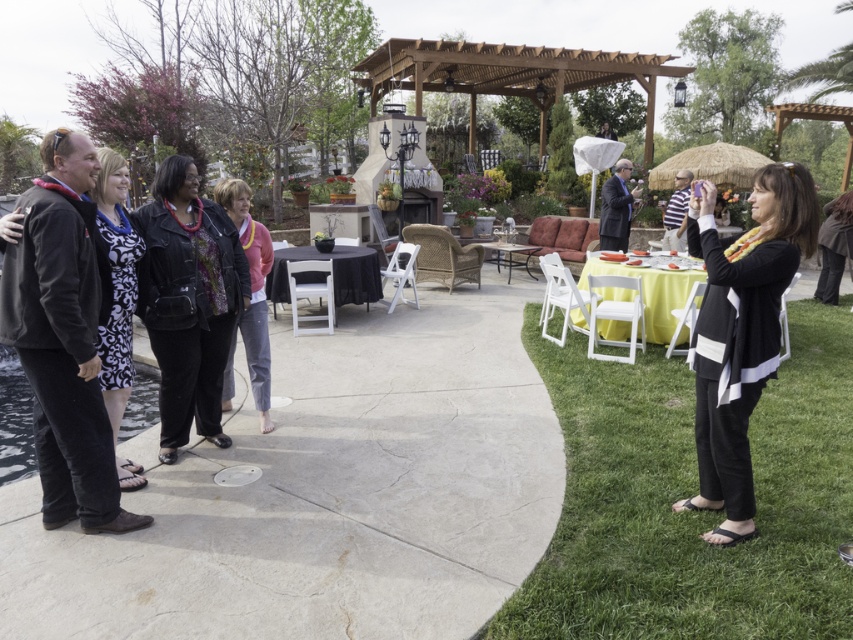
Question: Which of the following is the farthest from the observer?

Choices:
 (A) black matte jacket at right
 (B) black leather jacket at center
 (C) pink fabric jacket at center

Answer: (C)

Question: Is black matte jacket at right positioned in front of pink fabric jacket at center?

Choices:
 (A) no
 (B) yes

Answer: (B)

Question: Which object is farther from the camera taking this photo?

Choices:
 (A) pink fabric jacket at center
 (B) black leather jacket at center

Answer: (A)

Question: Does black matte jacket at right have a smaller size compared to black leather jacket at center?

Choices:
 (A) yes
 (B) no

Answer: (B)

Question: Which of the following is the closest to the observer?

Choices:
 (A) black leather jacket at center
 (B) black matte jacket at right
 (C) pink fabric jacket at center

Answer: (B)

Question: Does black matte jacket at right appear on the left side of pink fabric jacket at center?

Choices:
 (A) no
 (B) yes

Answer: (A)